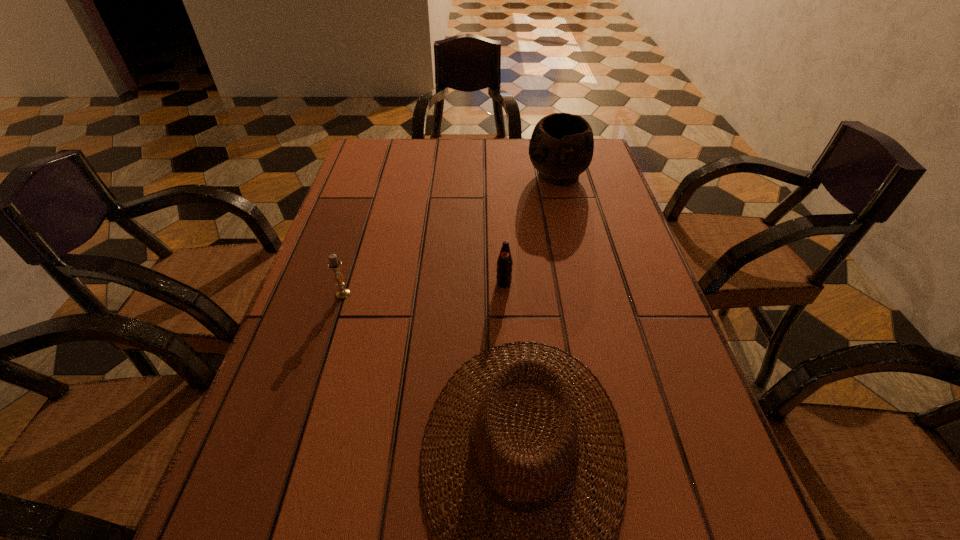
The image size is (960, 540). Find the location of `pottery`. pottery is located at coordinates (561, 147).

Locate an element on the screen. the farthest object is located at coordinates (561, 147).

In order to click on the third nearest object in this screenshot , I will do `click(504, 269)`.

This screenshot has height=540, width=960. What are the coordinates of `the third farthest object` in the screenshot? It's located at (333, 264).

Image resolution: width=960 pixels, height=540 pixels. In order to click on the leftmost object in this screenshot , I will do `click(333, 264)`.

Find the location of a particular element. This screenshot has width=960, height=540. vacant region located on the left of the farthest object is located at coordinates (473, 176).

In order to click on free space located on the front label of the second farthest object in this screenshot , I will do `click(506, 315)`.

The image size is (960, 540). In order to click on vacant space located on the front of the leftmost object in this screenshot , I will do `click(321, 369)`.

Locate an element on the screen. object situated at the far edge is located at coordinates (561, 147).

You are a GUI agent. You are given a task and a screenshot of the screen. Output one action in this format:
    pyautogui.click(x=<x>, y=<y>)
    Task: Click on the object present at the left edge
    This screenshot has height=540, width=960.
    Given the screenshot: What is the action you would take?
    pyautogui.click(x=333, y=264)